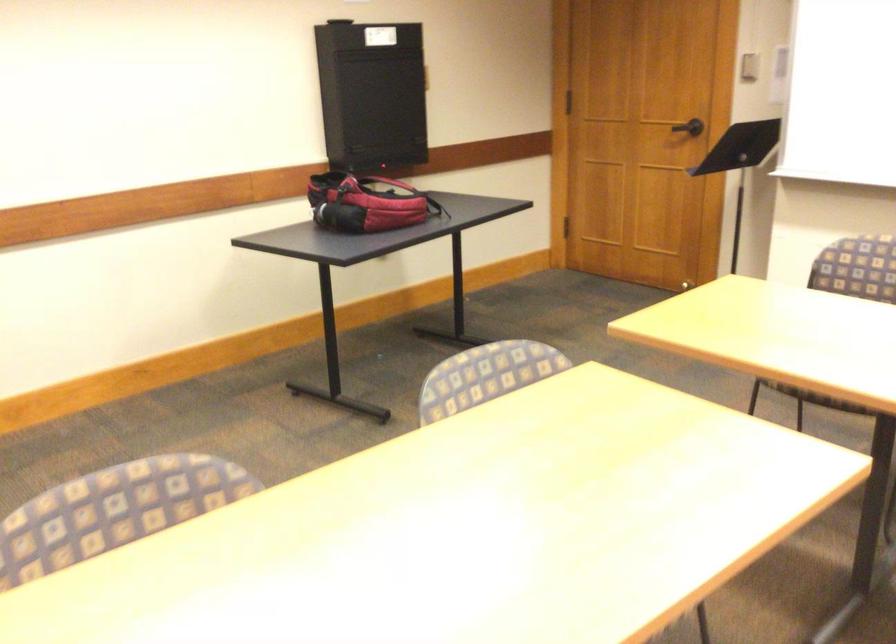
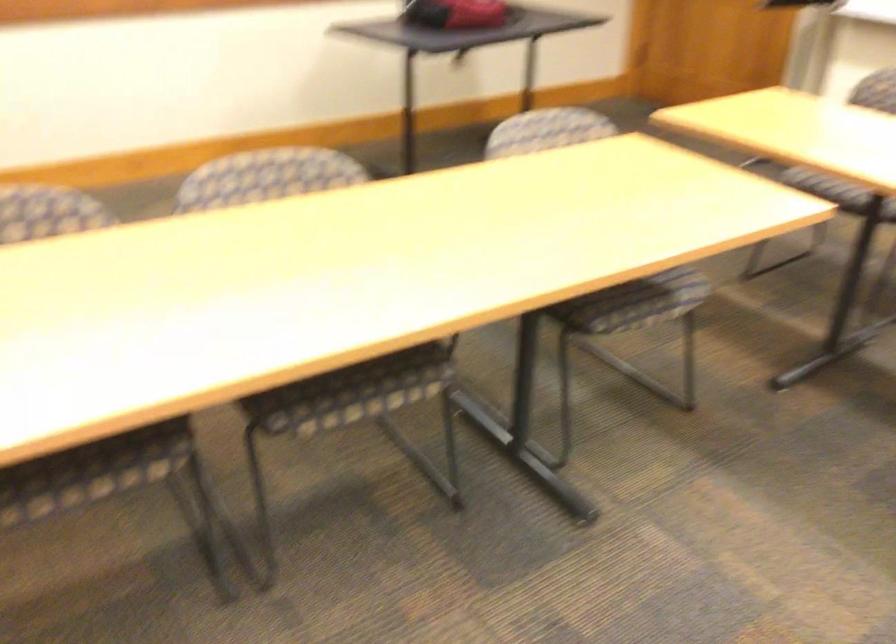
Question: The images are taken continuously from a first-person perspective. In which direction is your viewpoint rotating?

Choices:
 (A) Left
 (B) Right
 (C) Up
 (D) Down

Answer: (D)